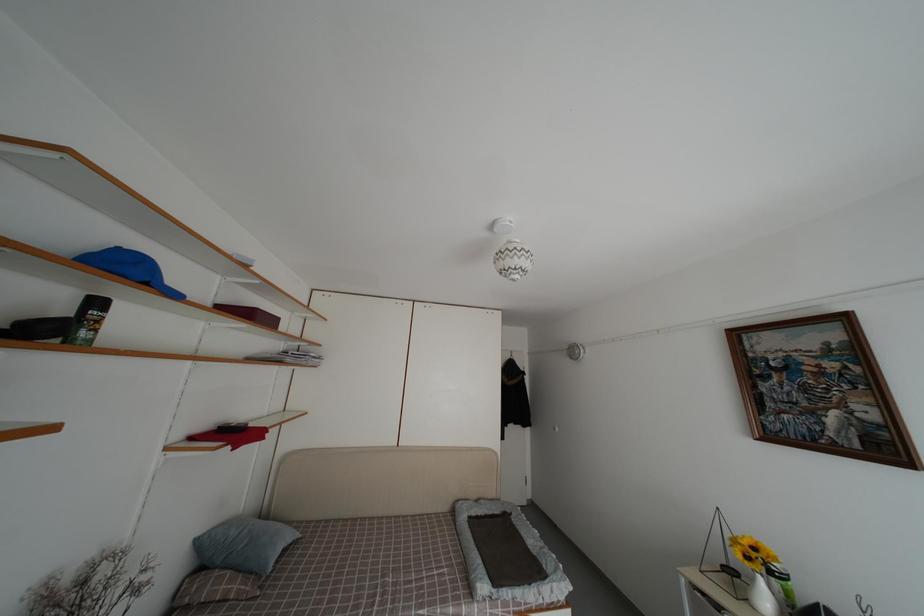
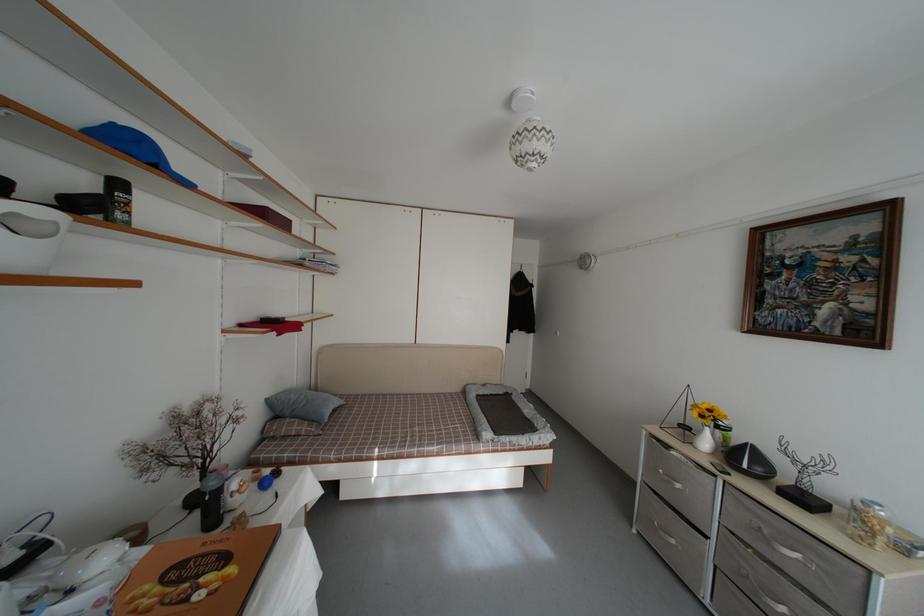
Question: In a continuous first-person perspective shot, in which direction is the camera moving?

Choices:
 (A) Left
 (B) Right
 (C) Forward
 (D) Backward

Answer: (D)